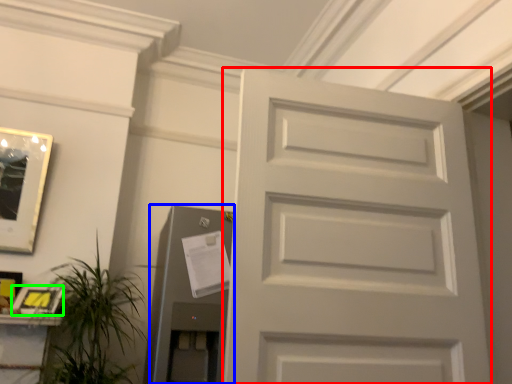
Question: Which object is the closest to the door (highlighted by a red box)? Choose among these: elevator (highlighted by a blue box) or picture frame (highlighted by a green box).

Choices:
 (A) elevator
 (B) picture frame

Answer: (A)